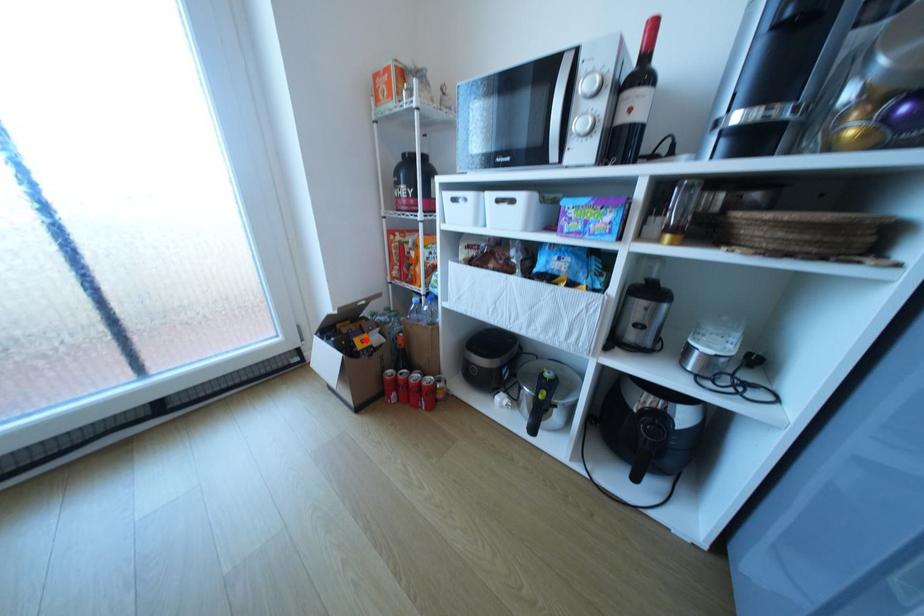
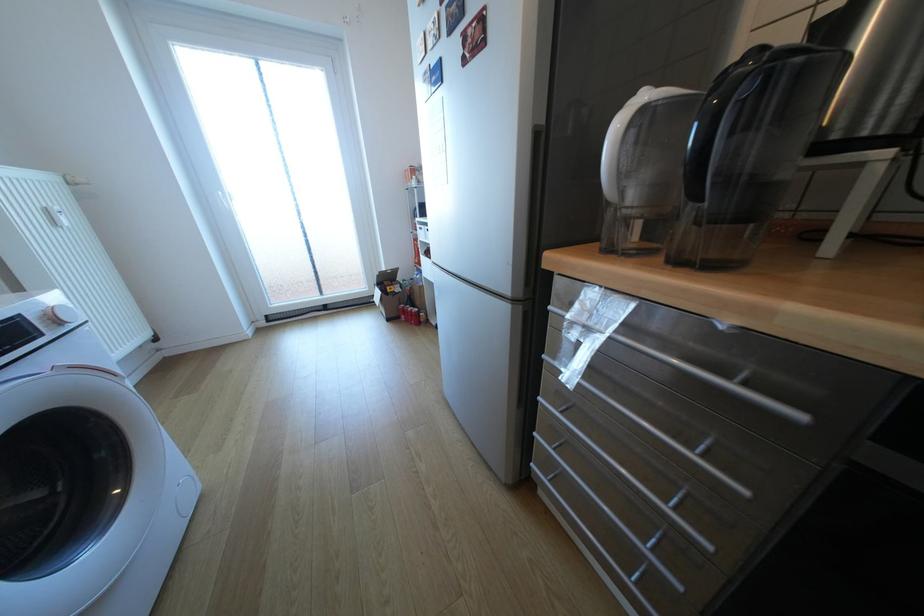
Question: I am providing you with two images of the same scene from different viewpoints. A red point is marked on the first image. At the location where the point appears in image 1, is it still visible in image 2?

Choices:
 (A) Yes
 (B) No

Answer: (A)